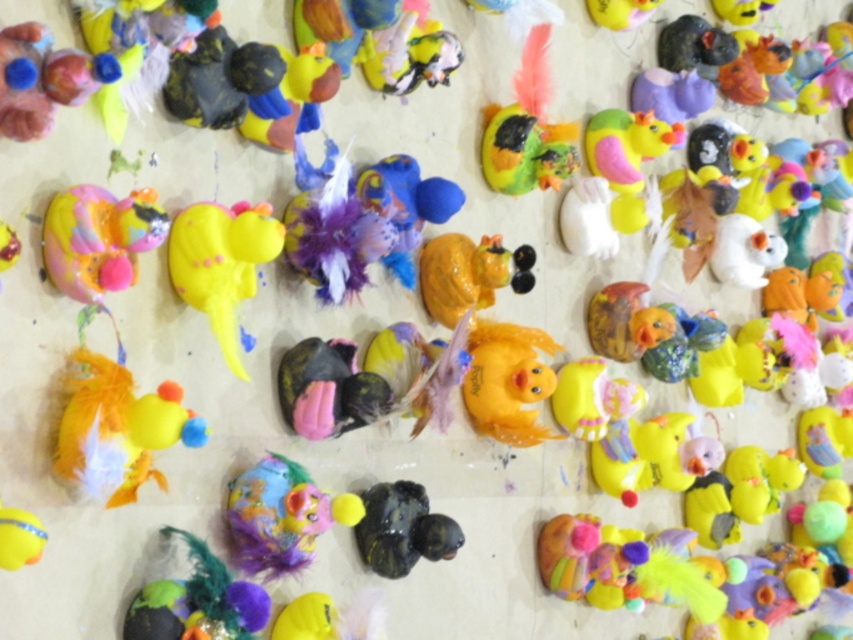
Is point (253, 465) less distant than point (416, 500)?

That is True.

Is multicolored clay duckling at center thinner than shiny black duck at center?

No.

Is point (242, 544) farther from camera compared to point (395, 493)?

No, (242, 544) is closer to viewer.

Locate an element on the screen. Image resolution: width=853 pixels, height=640 pixels. multicolored clay duckling at center is located at coordinates (280, 516).

Who is positioned more to the right, yellow matte rubber duck at center or shiny black duck at center?

From the viewer's perspective, shiny black duck at center appears more on the right side.

Can you confirm if yellow matte rubber duck at center is shorter than shiny black duck at center?

Incorrect, yellow matte rubber duck at center's height does not fall short of shiny black duck at center's.

Image resolution: width=853 pixels, height=640 pixels. What do you see at coordinates (221, 262) in the screenshot? I see `yellow matte rubber duck at center` at bounding box center [221, 262].

The height and width of the screenshot is (640, 853). What are the coordinates of `yellow matte rubber duck at center` in the screenshot? It's located at (221, 262).

Who is more distant from viewer, (68, 396) or (422, 301)?

The point (422, 301) is behind.

Can you confirm if matte yellow duckling at lower left is bigger than matte orange rubber duck at center?

Yes, matte yellow duckling at lower left is bigger than matte orange rubber duck at center.

What do you see at coordinates (119, 429) in the screenshot? I see `matte yellow duckling at lower left` at bounding box center [119, 429].

At what (x,y) coordinates should I click in order to perform the action: click on matte yellow duckling at lower left. Please return your answer as a coordinate pair (x, y). Looking at the image, I should click on (119, 429).